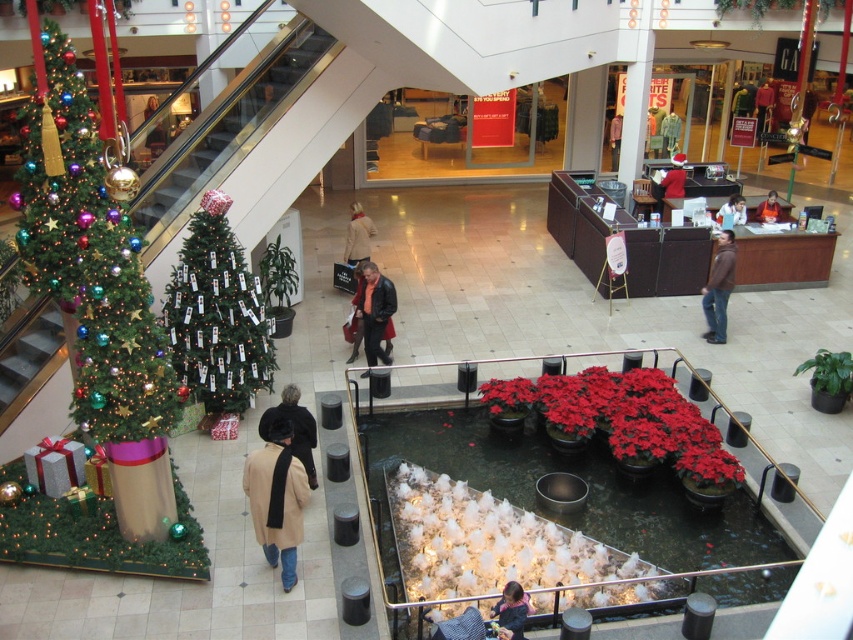
You are standing in the mall and want to take a photo of both the point at coordinates point (384, 296) and point (288, 410). Which point should you focus on first to ensure both are in the frame?

You should focus on point (384, 296) first because it is closer to you than point (288, 410), ensuring both points remain in the frame.

You are standing at the entrance of the mall and want to reach the orange sweater at center. There is a green textured christmas tree at left in your path. Can you walk around it? Explain why or why not based on their distance.

The green textured christmas tree at left is 30.62 feet away from the orange sweater at center. Since the distance is quite large, you can easily walk around the tree to reach the orange sweater at center without any issues.

You are a store manager organizing a holiday display. You have a shelf that is 1 meter wide. You need to place both the leather jacket at center and the black fur hat at center on this shelf. Can both items fit side by side on the shelf without overlapping?

The leather jacket at center might be wider than the black fur hat at center. Since the shelf is 1 meter wide, it is possible that both items can fit side by side, but there is uncertainty due to the jacket potentially taking up more space.